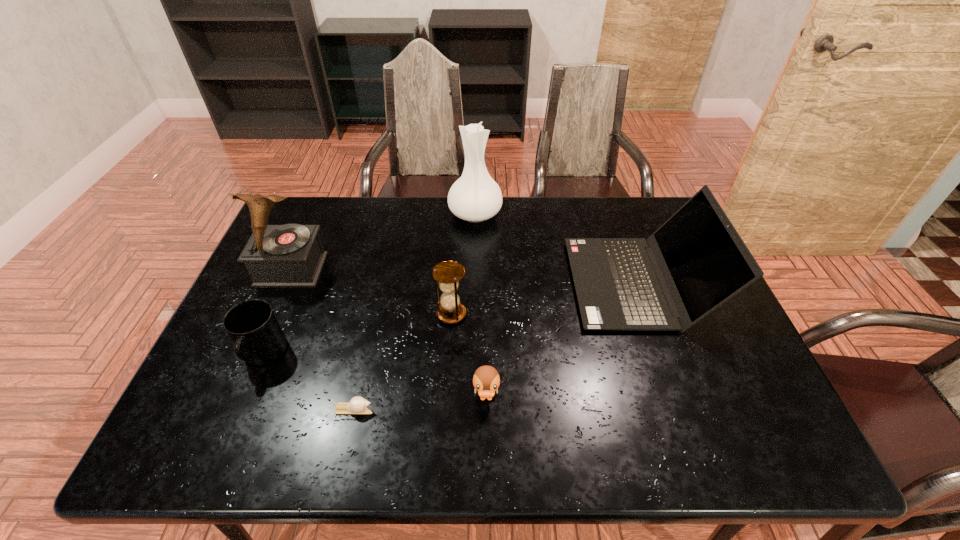
Where is `vacant space that is in between the escargot and the fifth tallest object`? vacant space that is in between the escargot and the fifth tallest object is located at coordinates (308, 382).

This screenshot has height=540, width=960. Find the location of `free point between the farthest object and the laptop computer`. free point between the farthest object and the laptop computer is located at coordinates (557, 248).

Locate an element on the screen. The image size is (960, 540). vacant region between the duck and the laptop computer is located at coordinates (563, 341).

Locate an element on the screen. vacant space that is in between the farthest object and the fourth shortest object is located at coordinates (464, 264).

Locate an element on the screen. vacant space that's between the phonograph_record and the escargot is located at coordinates (323, 340).

The height and width of the screenshot is (540, 960). I want to click on free space between the phonograph_record and the rightmost object, so click(465, 276).

I want to click on unoccupied area between the sixth tallest object and the third shortest object, so click(375, 376).

Where is `object that is the third closest to the vase`? object that is the third closest to the vase is located at coordinates (291, 255).

Locate which object ranks sixth in proximity to the duck. Please provide its 2D coordinates. Your answer should be formatted as a tuple, i.e. [(x, y)], where the tuple contains the x and y coordinates of a point satisfying the conditions above.

[(475, 196)]

Identify the location of free spot that satisfies the following two spatial constraints: 1. on the front side of the fourth shortest object; 2. on the shell of the escargot. The image size is (960, 540). (445, 409).